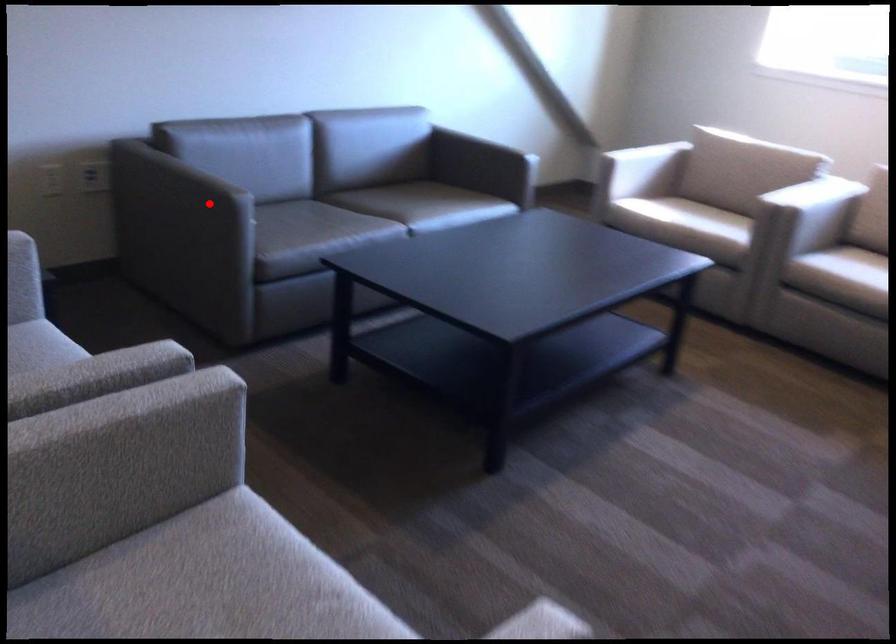
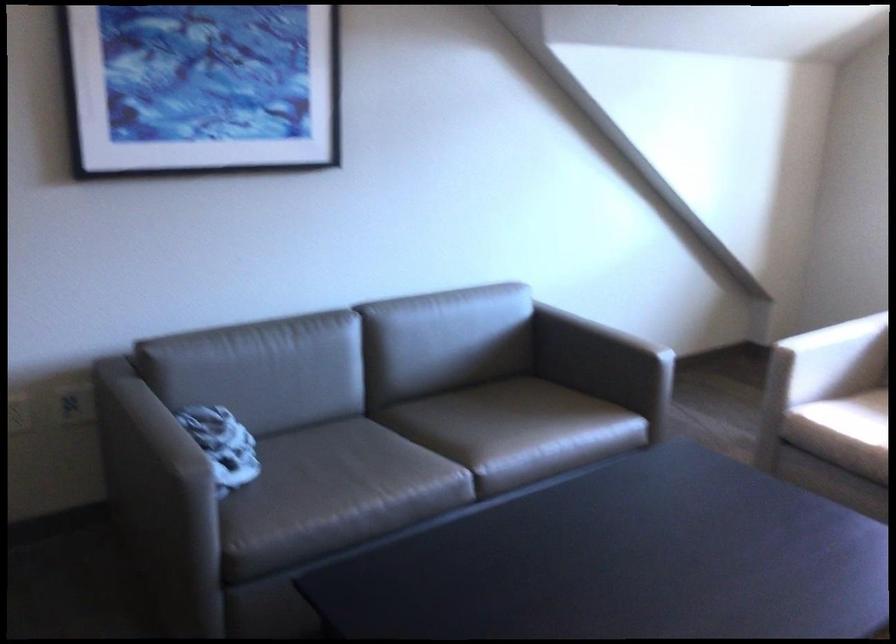
Question: I am providing you with two images of the same scene from different viewpoints. A red point is shown in image1. For the corresponding object point in image2, is it positioned nearer or farther from the camera?

Choices:
 (A) Nearer
 (B) Farther

Answer: (A)